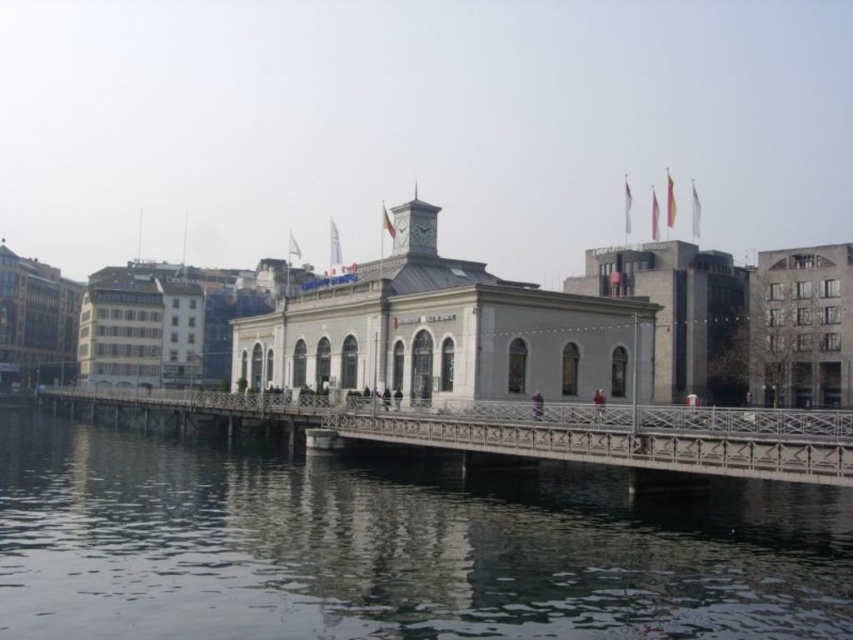
Does smooth dark water at lower center have a greater width compared to metallic gray bridge at center?

No, smooth dark water at lower center is not wider than metallic gray bridge at center.

Is smooth dark water at lower center above metallic gray bridge at center?

No.

I want to click on smooth dark water at lower center, so click(393, 547).

Identify the location of smooth dark water at lower center. This screenshot has width=853, height=640. (393, 547).